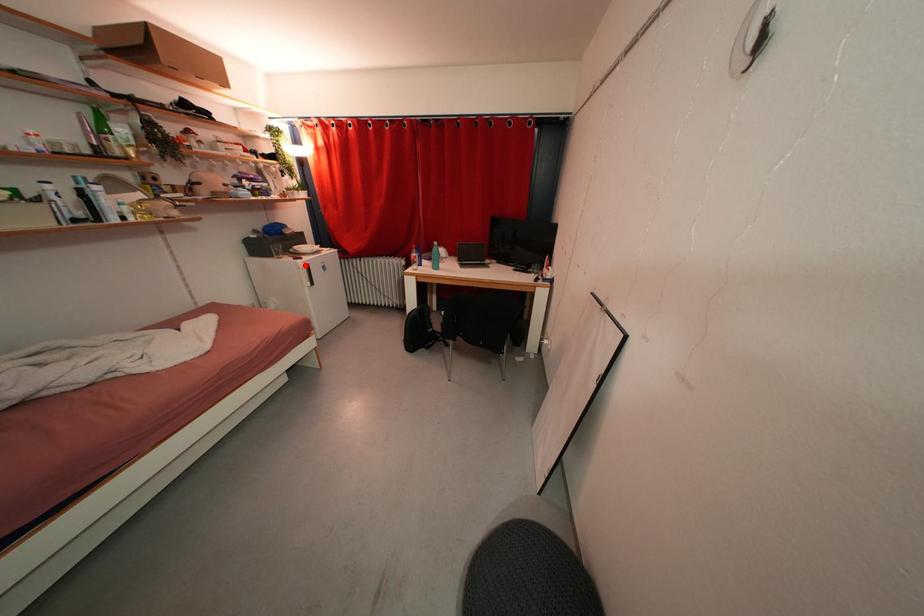
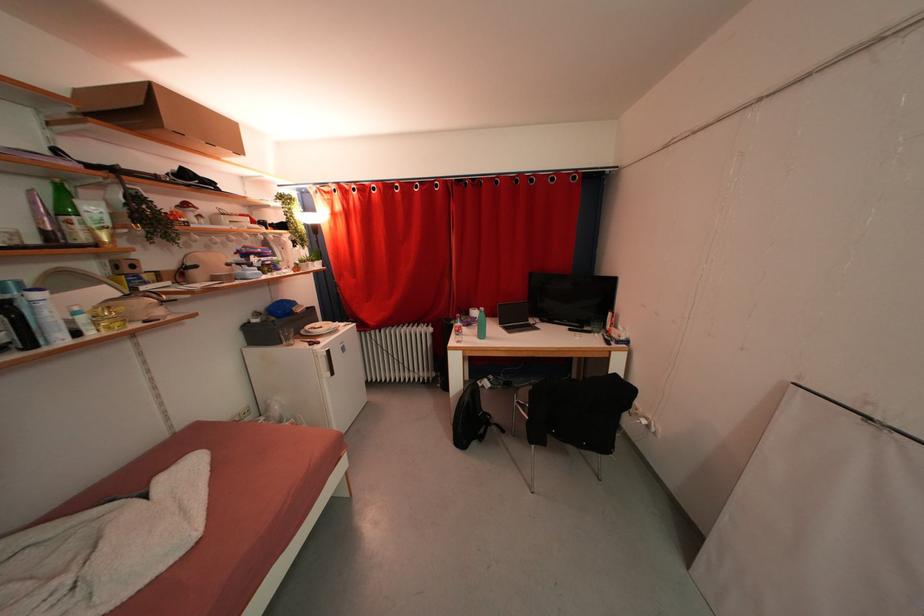
Find the pixel in the second image that matches the highlighted location in the first image.

(322, 351)